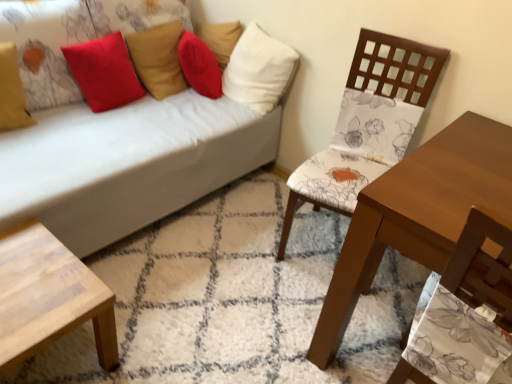
Locate an element on the screen. free space in front of floral fabric chair at center right is located at coordinates (283, 312).